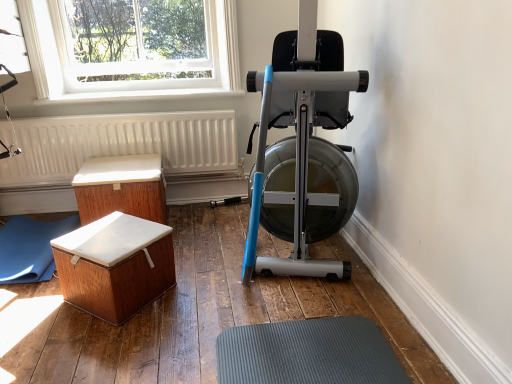
The width and height of the screenshot is (512, 384). What do you see at coordinates (115, 265) in the screenshot?
I see `wooden chest at lower left, marked as the 2th furniture in a back-to-front arrangement` at bounding box center [115, 265].

What are the coordinates of `white textured radiator at lower left` in the screenshot? It's located at (122, 145).

How much space does white wood chest at lower left, positioned as the 1th furniture in back-to-front order, occupy vertically?

white wood chest at lower left, positioned as the 1th furniture in back-to-front order, is 38.74 centimeters in height.

Measure the distance between blue rubber yoga mat at lower left and camera.

The depth of blue rubber yoga mat at lower left is 1.94 meters.

What do you see at coordinates (30, 248) in the screenshot?
I see `blue rubber yoga mat at lower left` at bounding box center [30, 248].

Looking at this image, in order to face silver metallic stationary bicycle at center, should I rotate leftwards or rightwards?

Rotate right and turn 4.657 degrees.

What is the approximate width of silver metallic stationary bicycle at center?

silver metallic stationary bicycle at center is 82.91 centimeters wide.

Find the location of a particular element. This screenshot has width=512, height=384. wooden chest at lower left, marked as the 2th furniture in a back-to-front arrangement is located at coordinates (115, 265).

From the image's perspective, between white wood chest at lower left, placed as the 2th furniture when sorted from front to back, and silver metallic stationary bicycle at center, who is located below?

white wood chest at lower left, placed as the 2th furniture when sorted from front to back, from the image's perspective.

Could you measure the distance between white wood chest at lower left, placed as the 2th furniture when sorted from front to back, and silver metallic stationary bicycle at center?

white wood chest at lower left, placed as the 2th furniture when sorted from front to back, and silver metallic stationary bicycle at center are 33.63 inches apart from each other.

Does white wood chest at lower left, placed as the 2th furniture when sorted from front to back, have a lesser height compared to silver metallic stationary bicycle at center?

Correct, white wood chest at lower left, placed as the 2th furniture when sorted from front to back, is not as tall as silver metallic stationary bicycle at center.

Consider the image. How different are the orientations of blue rubber yoga mat at lower left and silver metallic stationary bicycle at center in degrees?

The angular difference between blue rubber yoga mat at lower left and silver metallic stationary bicycle at center is 1.12 degrees.

Considering the sizes of objects blue rubber yoga mat at lower left and silver metallic stationary bicycle at center in the image provided, who is wider, blue rubber yoga mat at lower left or silver metallic stationary bicycle at center?

With larger width is silver metallic stationary bicycle at center.

Considering the sizes of blue rubber yoga mat at lower left and silver metallic stationary bicycle at center in the image, is blue rubber yoga mat at lower left bigger or smaller than silver metallic stationary bicycle at center?

Clearly, blue rubber yoga mat at lower left is smaller in size than silver metallic stationary bicycle at center.

Is point (47, 265) closer or farther from the camera than point (330, 71)?

Point (47, 265) appears to be farther away from the viewer than point (330, 71).

Looking at this image, is white textured radiator at lower left far from wooden chest at lower left, which ranks as the 1th furniture in front-to-back order?

No, white textured radiator at lower left is in close proximity to wooden chest at lower left, which ranks as the 1th furniture in front-to-back order.

Find the location of a particular element. The height and width of the screenshot is (384, 512). furniture that is the 2nd object located below the white textured radiator at lower left (from the image's perspective) is located at coordinates (115, 265).

Considering the relative sizes of white textured radiator at lower left and wooden chest at lower left, which ranks as the 1th furniture in front-to-back order, in the image provided, is white textured radiator at lower left thinner than wooden chest at lower left, which ranks as the 1th furniture in front-to-back order,?

Indeed, white textured radiator at lower left has a lesser width compared to wooden chest at lower left, which ranks as the 1th furniture in front-to-back order.

Considering the relative positions of white textured radiator at lower left and wooden chest at lower left, which ranks as the 1th furniture in front-to-back order, in the image provided, is white textured radiator at lower left to the left or to the right of wooden chest at lower left, which ranks as the 1th furniture in front-to-back order,?

In the image, white textured radiator at lower left appears on the left side of wooden chest at lower left, which ranks as the 1th furniture in front-to-back order.

Is clear glass window at upper left beside wooden chest at lower left, which ranks as the 1th furniture in front-to-back order?

No.

In the scene shown: Is clear glass window at upper left inside or outside of wooden chest at lower left, marked as the 2th furniture in a back-to-front arrangement?

clear glass window at upper left is spatially situated outside wooden chest at lower left, marked as the 2th furniture in a back-to-front arrangement.

Can you tell me how much clear glass window at upper left and wooden chest at lower left, marked as the 2th furniture in a back-to-front arrangement, differ in facing direction?

There is a 40.5-degree angle between the facing directions of clear glass window at upper left and wooden chest at lower left, marked as the 2th furniture in a back-to-front arrangement.

Which of these two, clear glass window at upper left or wooden chest at lower left, marked as the 2th furniture in a back-to-front arrangement, is wider?

wooden chest at lower left, marked as the 2th furniture in a back-to-front arrangement.

Locate an element on the screen. The image size is (512, 384). furniture located above the wooden chest at lower left, marked as the 2th furniture in a back-to-front arrangement (from the image's perspective) is located at coordinates (121, 188).

Is wooden chest at lower left, which ranks as the 1th furniture in front-to-back order, located outside white wood chest at lower left, positioned as the 1th furniture in back-to-front order?

Yes, wooden chest at lower left, which ranks as the 1th furniture in front-to-back order, is outside of white wood chest at lower left, positioned as the 1th furniture in back-to-front order.

Does point (115, 302) come farther from viewer compared to point (110, 158)?

That is False.

From their relative heights in the image, would you say wooden chest at lower left, marked as the 2th furniture in a back-to-front arrangement, is taller or shorter than white wood chest at lower left, placed as the 2th furniture when sorted from front to back?

wooden chest at lower left, marked as the 2th furniture in a back-to-front arrangement, is shorter than white wood chest at lower left, placed as the 2th furniture when sorted from front to back.

From a real-world perspective, is silver metallic stationary bicycle at center beneath clear glass window at upper left?

Yes, from a real-world perspective, silver metallic stationary bicycle at center is below clear glass window at upper left.

Does silver metallic stationary bicycle at center have a greater width compared to clear glass window at upper left?

Yes.

From the image's perspective, is silver metallic stationary bicycle at center on clear glass window at upper left?

No, from the image's perspective, silver metallic stationary bicycle at center is not above clear glass window at upper left.

The height and width of the screenshot is (384, 512). I want to click on stationary bicycle lying below the clear glass window at upper left (from the image's perspective), so click(x=298, y=143).

Between point (9, 282) and point (131, 211), which one is positioned behind?

The point (131, 211) is farther from the camera.

Based on the photo, from the image's perspective, is blue rubber yoga mat at lower left above white wood chest at lower left, positioned as the 1th furniture in back-to-front order?

Actually, blue rubber yoga mat at lower left appears below white wood chest at lower left, positioned as the 1th furniture in back-to-front order, in the image.

I want to click on yoga mat below the white wood chest at lower left, positioned as the 1th furniture in back-to-front order (from a real-world perspective), so click(30, 248).

Is blue rubber yoga mat at lower left at the left side of white wood chest at lower left, placed as the 2th furniture when sorted from front to back?

Yes.

Find the location of `the 2nd furniture behind the silver metallic stationary bicycle at center, starting your count from the anchor`. the 2nd furniture behind the silver metallic stationary bicycle at center, starting your count from the anchor is located at coordinates (121, 188).

The height and width of the screenshot is (384, 512). Identify the location of stationary bicycle located above the blue rubber yoga mat at lower left (from a real-world perspective). (298, 143).

Based on their spatial positions, is silver metallic stationary bicycle at center or clear glass window at upper left further from blue rubber yoga mat at lower left?

Among the two, silver metallic stationary bicycle at center is located further to blue rubber yoga mat at lower left.

From the image, which object appears to be farther from clear glass window at upper left, white textured radiator at lower left or wooden chest at lower left, marked as the 2th furniture in a back-to-front arrangement?

wooden chest at lower left, marked as the 2th furniture in a back-to-front arrangement.

Estimate the real-world distances between objects in this image. Which object is further from white textured radiator at lower left, wooden chest at lower left, marked as the 2th furniture in a back-to-front arrangement, or silver metallic stationary bicycle at center?

silver metallic stationary bicycle at center.

Based on their spatial positions, is silver metallic stationary bicycle at center or wooden chest at lower left, marked as the 2th furniture in a back-to-front arrangement, further from white textured radiator at lower left?

silver metallic stationary bicycle at center lies further to white textured radiator at lower left than the other object.

Looking at the image, which one is located further to silver metallic stationary bicycle at center, blue rubber yoga mat at lower left or white textured radiator at lower left?

blue rubber yoga mat at lower left lies further to silver metallic stationary bicycle at center than the other object.

Consider the image. When comparing their distances from wooden chest at lower left, marked as the 2th furniture in a back-to-front arrangement, does blue rubber yoga mat at lower left or clear glass window at upper left seem further?

clear glass window at upper left is positioned further to the anchor wooden chest at lower left, marked as the 2th furniture in a back-to-front arrangement.

Estimate the real-world distances between objects in this image. Which object is further from white wood chest at lower left, positioned as the 1th furniture in back-to-front order, clear glass window at upper left or wooden chest at lower left, marked as the 2th furniture in a back-to-front arrangement?

Among the two, clear glass window at upper left is located further to white wood chest at lower left, positioned as the 1th furniture in back-to-front order.

Based on their spatial positions, is blue rubber yoga mat at lower left or white textured radiator at lower left closer to clear glass window at upper left?

white textured radiator at lower left is positioned closer to the anchor clear glass window at upper left.

The width and height of the screenshot is (512, 384). Find the location of `window between white textured radiator at lower left and silver metallic stationary bicycle at center from left to right`. window between white textured radiator at lower left and silver metallic stationary bicycle at center from left to right is located at coordinates (127, 62).

Where is `yoga mat positioned between wooden chest at lower left, marked as the 2th furniture in a back-to-front arrangement, and white textured radiator at lower left from near to far`? yoga mat positioned between wooden chest at lower left, marked as the 2th furniture in a back-to-front arrangement, and white textured radiator at lower left from near to far is located at coordinates (30, 248).

Where is `furniture between wooden chest at lower left, which ranks as the 1th furniture in front-to-back order, and white textured radiator at lower left, along the z-axis`? The width and height of the screenshot is (512, 384). furniture between wooden chest at lower left, which ranks as the 1th furniture in front-to-back order, and white textured radiator at lower left, along the z-axis is located at coordinates (121, 188).

Where is `radiator between clear glass window at upper left and wooden chest at lower left, which ranks as the 1th furniture in front-to-back order, in the vertical direction`? radiator between clear glass window at upper left and wooden chest at lower left, which ranks as the 1th furniture in front-to-back order, in the vertical direction is located at coordinates (122, 145).